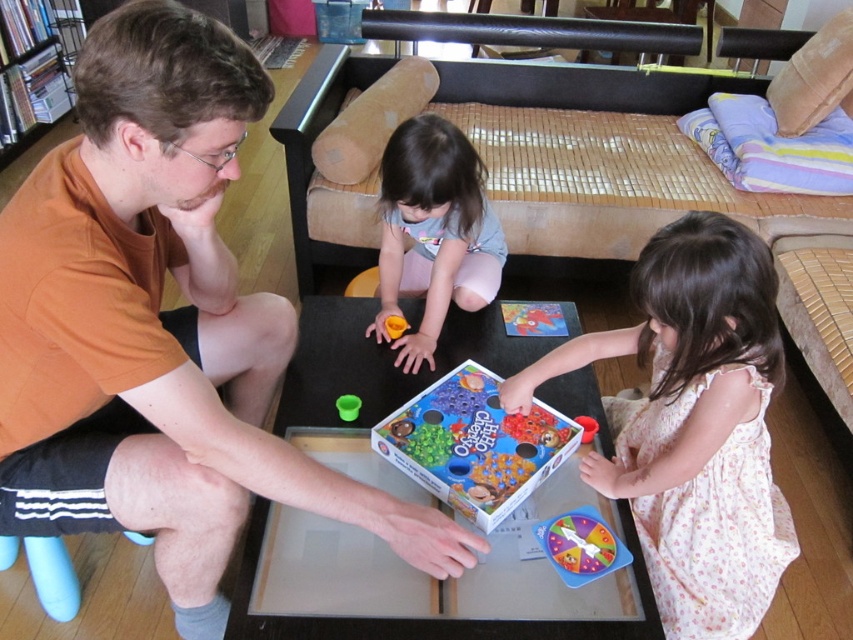
Can you confirm if orange t-shirt at upper left is positioned below black glass table at center?

No, orange t-shirt at upper left is not below black glass table at center.

Where is `orange t-shirt at upper left`? orange t-shirt at upper left is located at coordinates 158,326.

Identify the location of orange t-shirt at upper left. (158, 326).

Between black glass table at center and matte plastic board game at center, which one has more height?

With more height is black glass table at center.

You are a GUI agent. You are given a task and a screenshot of the screen. Output one action in this format:
    pyautogui.click(x=<x>, y=<y>)
    Task: Click on the black glass table at center
    
    Given the screenshot: What is the action you would take?
    click(x=340, y=368)

Between orange t-shirt at upper left and translucent plastic spinner at center, which one has more height?

orange t-shirt at upper left is taller.

From the picture: How much distance is there between orange t-shirt at upper left and translucent plastic spinner at center?

orange t-shirt at upper left and translucent plastic spinner at center are 31.53 inches apart from each other.

Is point (86, 116) farther from camera compared to point (584, 432)?

No, (86, 116) is in front of (584, 432).

Image resolution: width=853 pixels, height=640 pixels. What are the coordinates of `orange t-shirt at upper left` in the screenshot? It's located at (158, 326).